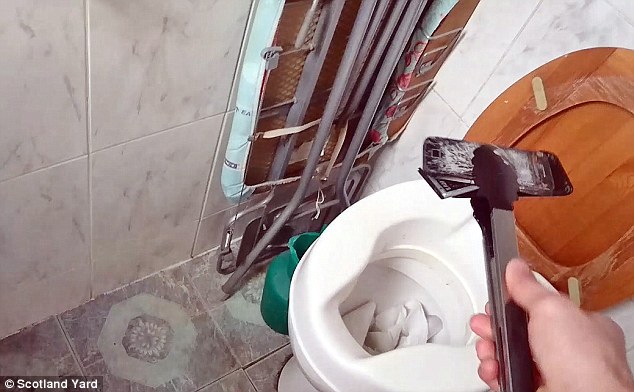
Where is `toilet seat`? The height and width of the screenshot is (392, 634). toilet seat is located at coordinates 605,78.